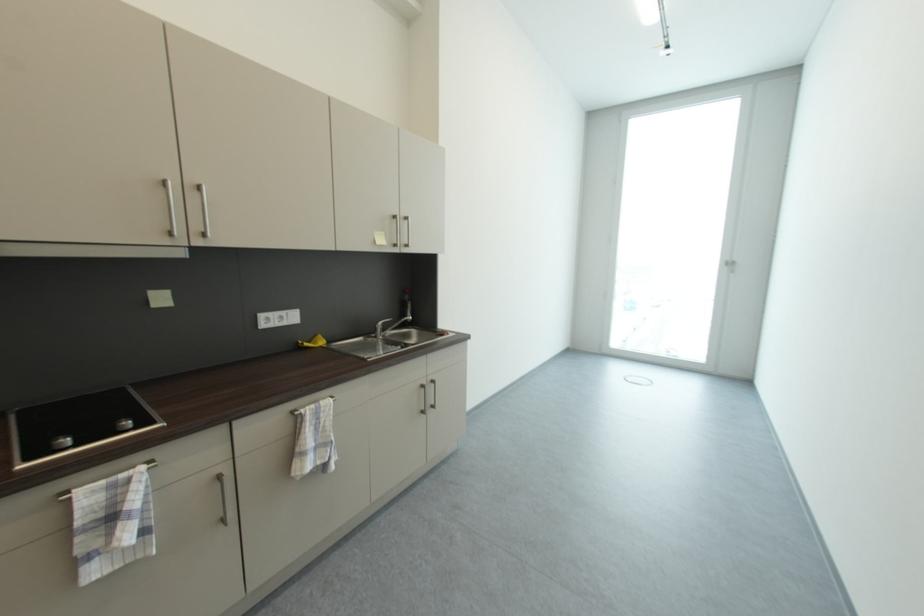
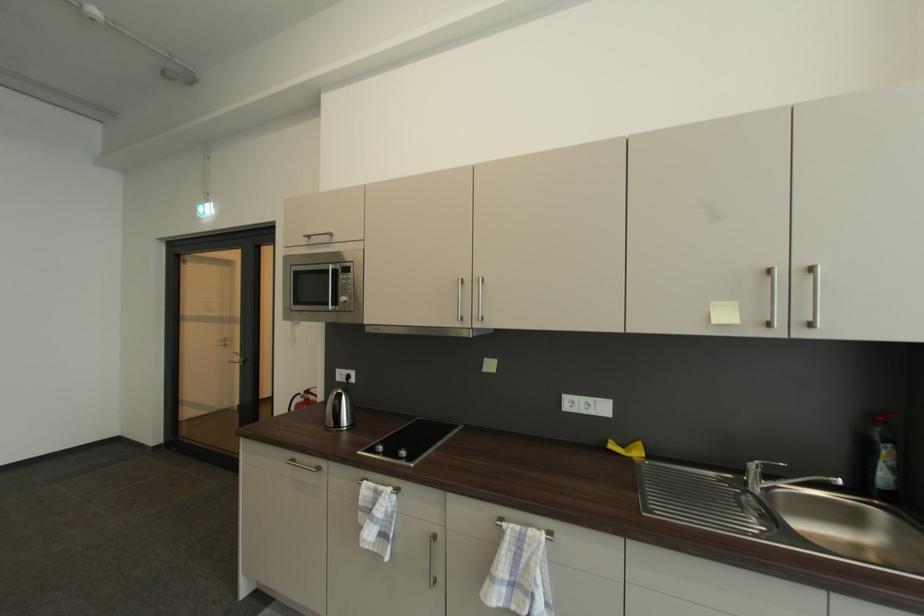
Find the pixel in the second image that matches [390,323] in the first image.

(769, 466)